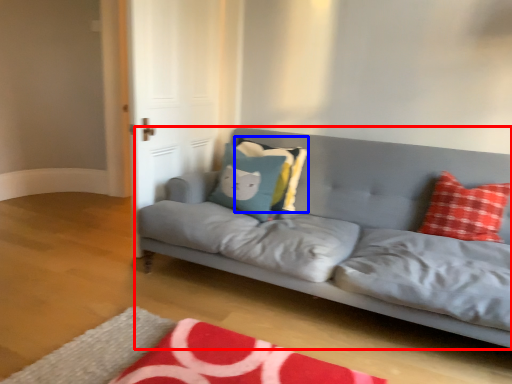
Question: Which object appears farthest to the camera in this image, studio couch (highlighted by a red box) or pillow (highlighted by a blue box)?

Choices:
 (A) studio couch
 (B) pillow

Answer: (B)